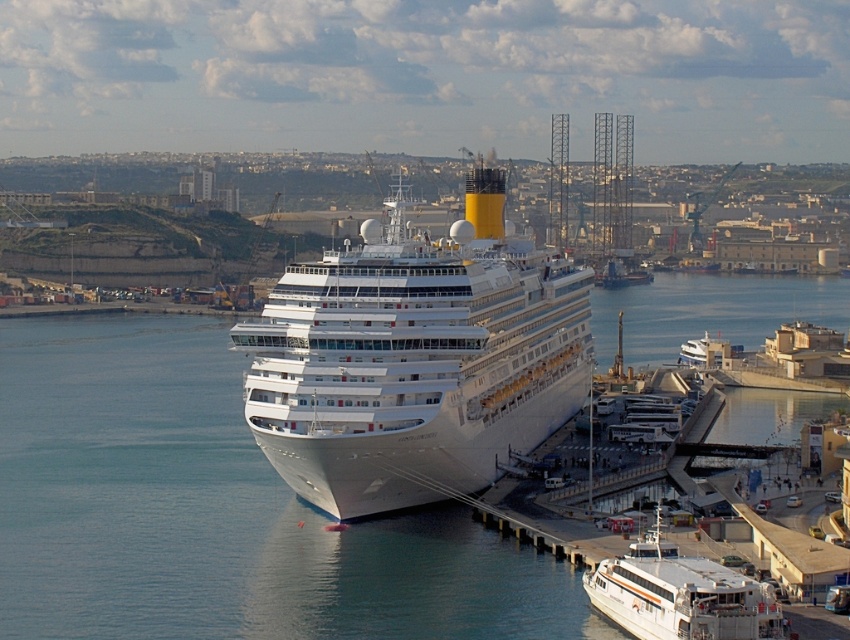
Can you confirm if clear blue water at center is thinner than white glossy ferry at lower right?

No.

Identify the location of clear blue water at center. The height and width of the screenshot is (640, 850). (214, 509).

Is point (689, 292) closer to camera compared to point (312, 424)?

No.

Does clear blue water at center lie in front of white glossy cruise ship at center?

Yes, it is in front of white glossy cruise ship at center.

Is point (105, 566) behind point (524, 436)?

No, (105, 566) is in front of (524, 436).

This screenshot has height=640, width=850. In order to click on clear blue water at center in this screenshot , I will do `click(214, 509)`.

Looking at this image, is white glossy cruise ship at center further to the viewer compared to white glossy ferry at lower right?

Yes, white glossy cruise ship at center is further from the viewer.

Is white glossy cruise ship at center shorter than white glossy ferry at lower right?

In fact, white glossy cruise ship at center may be taller than white glossy ferry at lower right.

I want to click on white glossy cruise ship at center, so click(415, 358).